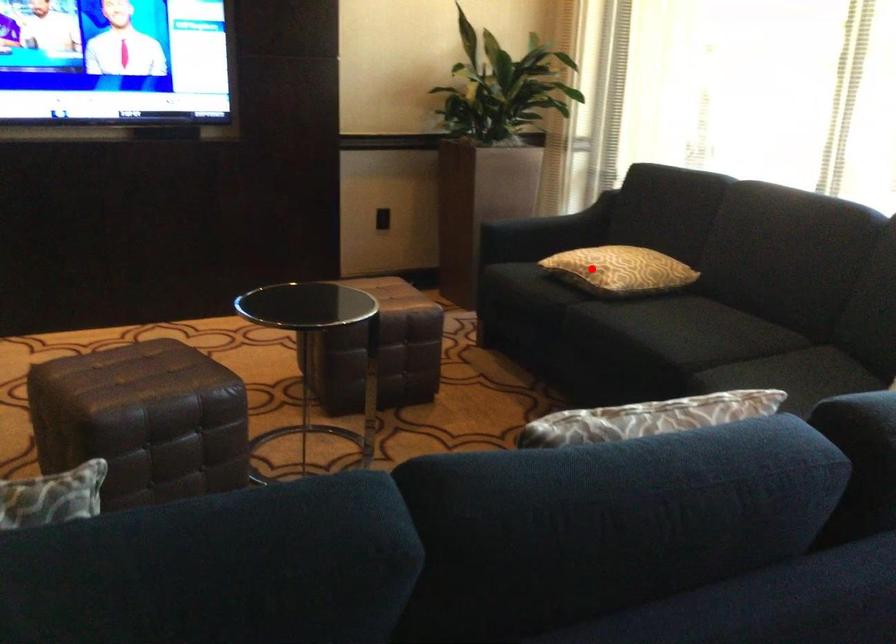
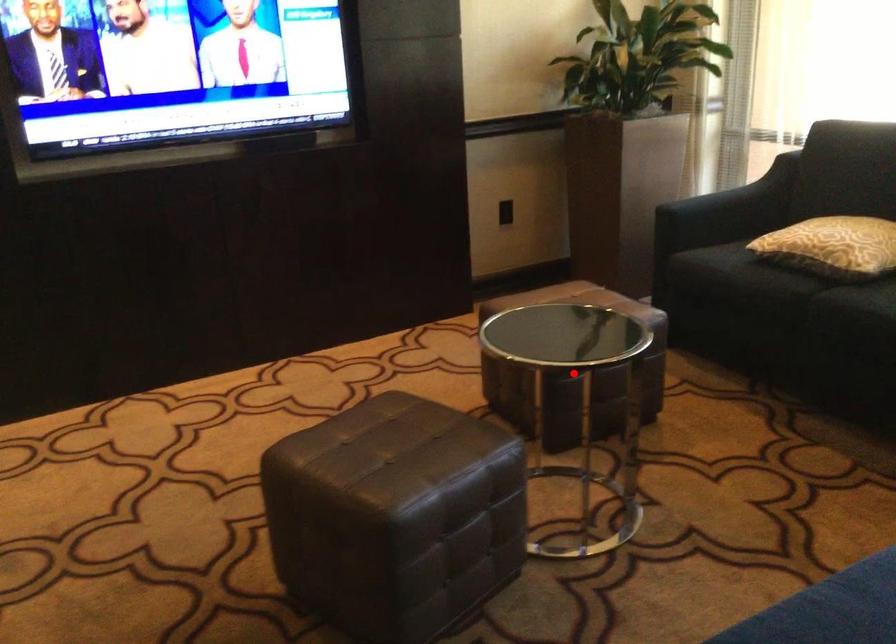
I am providing you with two images of the same scene from different viewpoints. A red point is marked on the first image and another point is marked on the second image. Are the points marked in image1 and image2 representing the same 3D position?

No